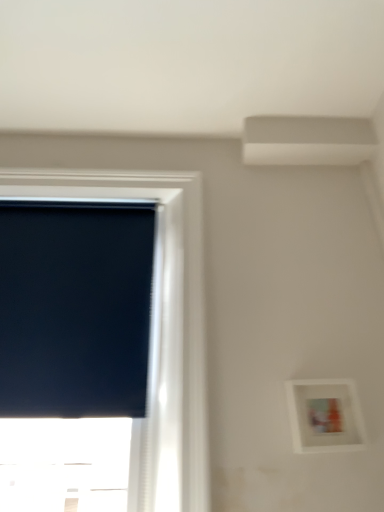
Image resolution: width=384 pixels, height=512 pixels. What do you see at coordinates (75, 308) in the screenshot?
I see `black matte window screen at left` at bounding box center [75, 308].

What do you see at coordinates (159, 320) in the screenshot?
I see `black matte window at left` at bounding box center [159, 320].

Find the location of a particular element. white matte picture frame at lower right is located at coordinates (325, 415).

Is white matte picture frame at lower right oriented towards black matte window at left?

No.

In the scene shown: In terms of height, does white matte picture frame at lower right look taller or shorter compared to black matte window at left?

Considering their sizes, white matte picture frame at lower right has less height than black matte window at left.

From a real-world perspective, is white matte picture frame at lower right over black matte window at left?

No, from a real-world perspective, white matte picture frame at lower right is not on top of black matte window at left.

Is white matte picture frame at lower right smaller than black matte window at left?

Correct, white matte picture frame at lower right occupies less space than black matte window at left.

Considering the relative positions of white matte picture frame at lower right and black matte window screen at left in the image provided, is white matte picture frame at lower right to the left of black matte window screen at left from the viewer's perspective?

In fact, white matte picture frame at lower right is to the right of black matte window screen at left.

Is white matte picture frame at lower right taller than black matte window screen at left?

Incorrect, the height of white matte picture frame at lower right is not larger of that of black matte window screen at left.

From the image's perspective, which one is positioned lower, white matte picture frame at lower right or black matte window screen at left?

white matte picture frame at lower right, from the image's perspective.

From the picture: Considering the sizes of objects white matte picture frame at lower right and black matte window screen at left in the image provided, who is wider, white matte picture frame at lower right or black matte window screen at left?

white matte picture frame at lower right is wider.

Is black matte window at left not inside black matte window screen at left?

Absolutely, black matte window at left is external to black matte window screen at left.

Does point (201, 180) come in front of point (137, 247)?

That is False.

Where is `window on the right of black matte window screen at left`? window on the right of black matte window screen at left is located at coordinates (159, 320).

In the image, there is a black matte window screen at left. At what (x,y) coordinates should I click in order to perform the action: click on window below it (from a real-world perspective). Please return your answer as a coordinate pair (x, y). The height and width of the screenshot is (512, 384). Looking at the image, I should click on (159, 320).

From the picture: Would you say black matte window screen at left contains black matte window at left?

Actually, black matte window at left is outside black matte window screen at left.

Considering the positions of objects black matte window screen at left and black matte window at left in the image provided, who is behind, black matte window screen at left or black matte window at left?

black matte window screen at left is more distant.

Can you confirm if black matte window screen at left is positioned to the right of white matte picture frame at lower right?

Incorrect, black matte window screen at left is not on the right side of white matte picture frame at lower right.

Which of these two, black matte window screen at left or white matte picture frame at lower right, stands taller?

black matte window screen at left.

Can you tell me how much black matte window screen at left and white matte picture frame at lower right differ in facing direction?

The facing directions of black matte window screen at left and white matte picture frame at lower right are 0.292 degrees apart.

Measure the distance from black matte window screen at left to white matte picture frame at lower right.

They are 35.42 inches apart.

Considering the relative positions of black matte window at left and white matte picture frame at lower right in the image provided, is black matte window at left to the left of white matte picture frame at lower right from the viewer's perspective?

Yes, black matte window at left is to the left of white matte picture frame at lower right.

From a real-world perspective, between black matte window at left and white matte picture frame at lower right, who is vertically lower?

In real-world perspective, white matte picture frame at lower right is lower.

Between black matte window at left and white matte picture frame at lower right, which one has more height?

black matte window at left.

Looking at this image, is black matte window at left beside white matte picture frame at lower right?

They are not placed beside each other.

The width and height of the screenshot is (384, 512). Find the location of `picture frame lying below the black matte window at left (from the image's perspective)`. picture frame lying below the black matte window at left (from the image's perspective) is located at coordinates (325, 415).

Where is `picture frame beneath the black matte window screen at left (from a real-world perspective)`? The height and width of the screenshot is (512, 384). picture frame beneath the black matte window screen at left (from a real-world perspective) is located at coordinates (325, 415).

Considering their positions, is black matte window at left positioned further to white matte picture frame at lower right than black matte window screen at left?

Among the two, black matte window screen at left is located further to white matte picture frame at lower right.

Estimate the real-world distances between objects in this image. Which object is closer to white matte picture frame at lower right, black matte window screen at left or black matte window at left?

black matte window at left is positioned closer to the anchor white matte picture frame at lower right.

Looking at the image, which one is located further to black matte window screen at left, white matte picture frame at lower right or black matte window at left?

white matte picture frame at lower right is positioned further to the anchor black matte window screen at left.

Estimate the real-world distances between objects in this image. Which object is further from black matte window at left, black matte window screen at left or white matte picture frame at lower right?

white matte picture frame at lower right is further to black matte window at left.

Based on their spatial positions, is black matte window at left or white matte picture frame at lower right further from black matte window screen at left?

white matte picture frame at lower right.

Looking at the image, which one is located closer to black matte window at left, white matte picture frame at lower right or black matte window screen at left?

The object closer to black matte window at left is black matte window screen at left.

The image size is (384, 512). I want to click on window between black matte window screen at left and white matte picture frame at lower right from left to right, so click(x=159, y=320).